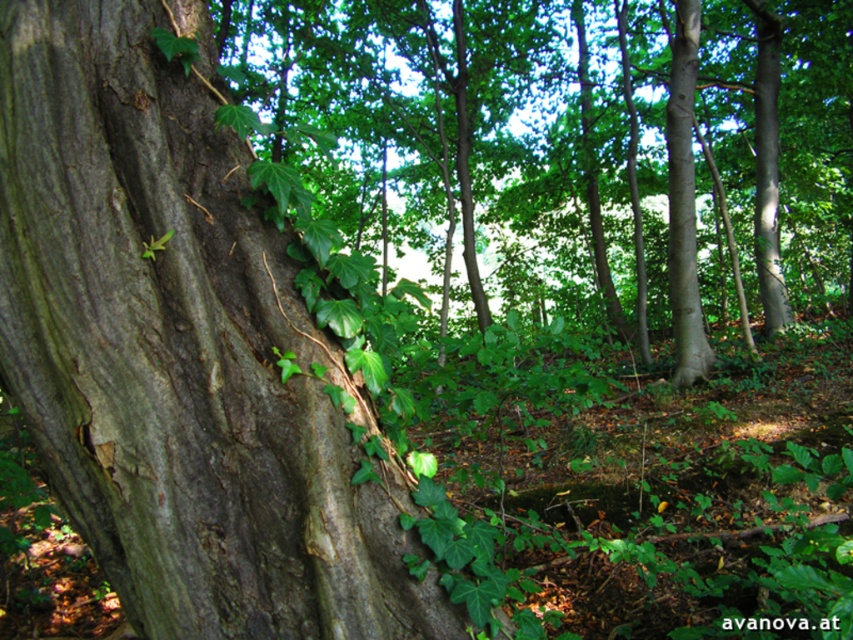
Question: Is smooth brown bark at left positioned behind green rough bark tree at center?

Choices:
 (A) no
 (B) yes

Answer: (A)

Question: Which object is farther from the camera taking this photo?

Choices:
 (A) green rough bark tree at center
 (B) smooth brown bark at left

Answer: (A)

Question: Is smooth brown bark at left bigger than green rough bark tree at center?

Choices:
 (A) no
 (B) yes

Answer: (A)

Question: Can you confirm if smooth brown bark at left is thinner than green rough bark tree at center?

Choices:
 (A) no
 (B) yes

Answer: (B)